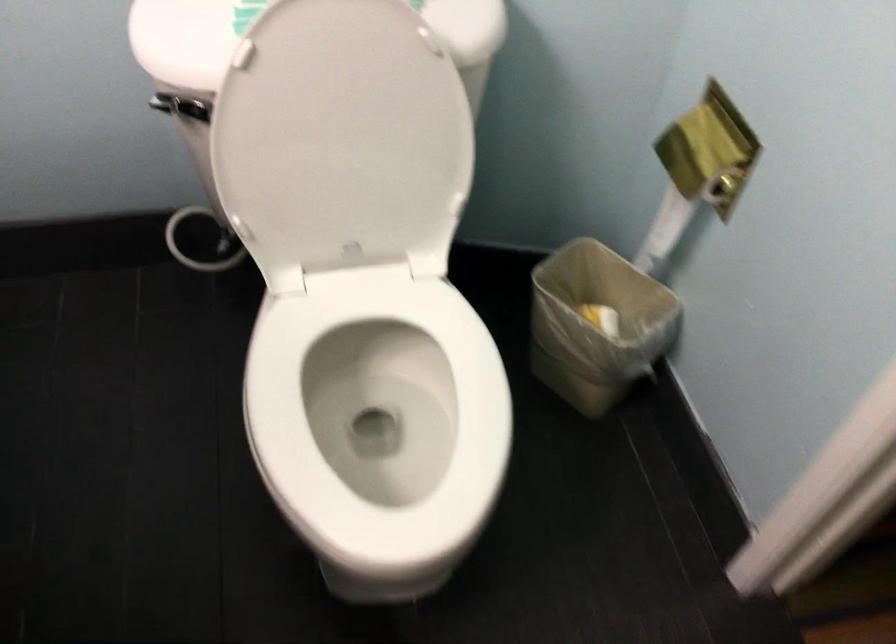
Based on the continuous images, in which direction is the camera rotating?

The rotation direction of the camera is right-down.